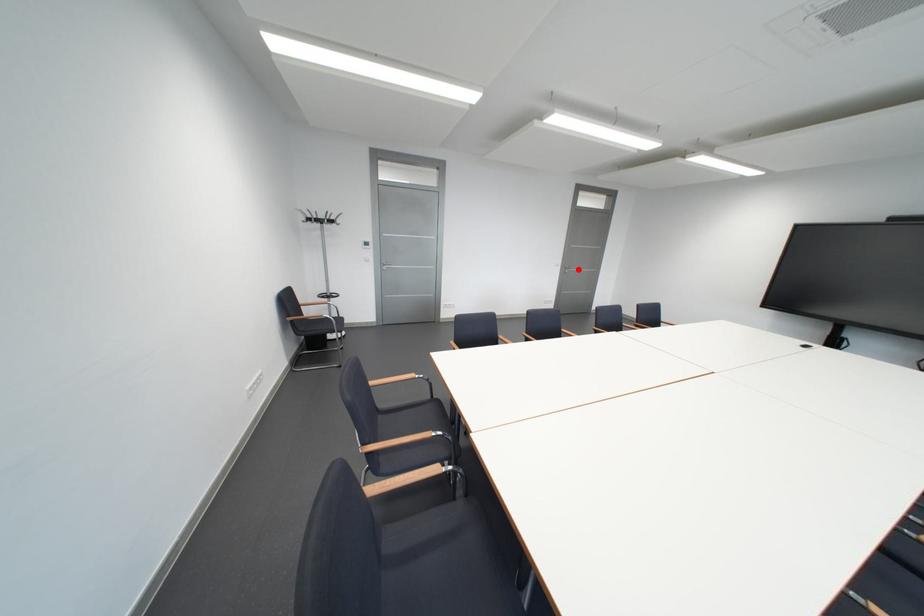
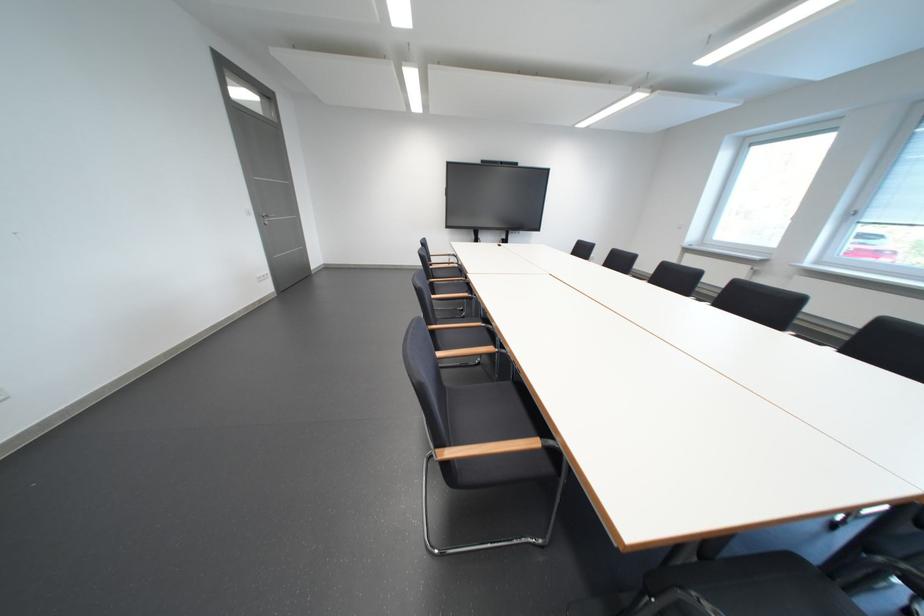
Where in the second image is the point corresponding to the highlighted location from the first image?

(274, 217)